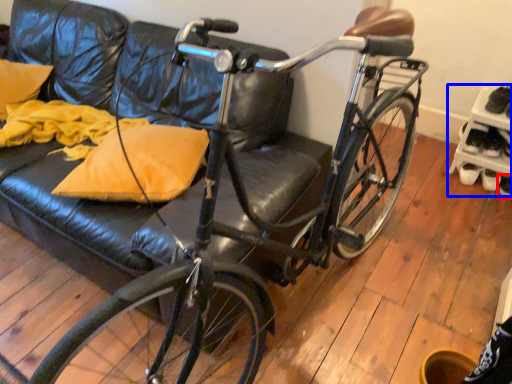
Question: Which object is closer to the camera taking this photo, footwear (highlighted by a red box) or shelf (highlighted by a blue box)?

Choices:
 (A) footwear
 (B) shelf

Answer: (B)